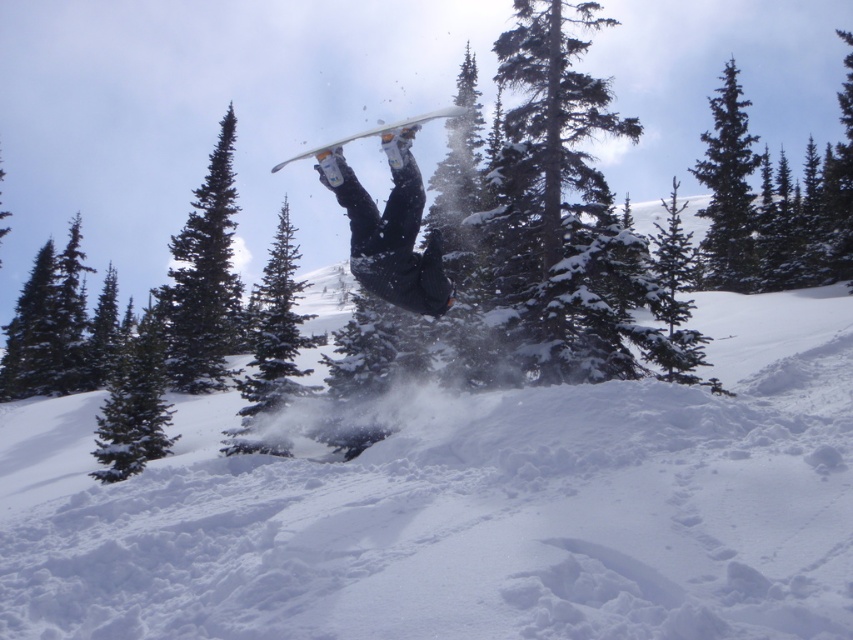
You are a photographer trying to capture the snowboarder midair. You notice the white fluffy snow at center and the matte black snowboard at center in your frame. Which object in your viewfinder appears wider?

The white fluffy snow at center appears wider than the matte black snowboard at center because its width is larger according to the description.

You are a photographer trying to capture the snowboarder midair between the two green matte trees. Which tree, the green matte tree at upper left or the green matte tree at upper right, should you position your camera closer to in order to frame the snowboarder properly?

The green matte tree at upper left is smaller than the green matte tree at upper right. To frame the snowboarder properly, position the camera closer to the green matte tree at upper left to ensure both trees are balanced in the composition.

You are a photographer aiming to capture the snowboarder midair between the green matte tree at upper left and the green matte tree at upper right. Which tree should you position yourself closer to in order to frame the snowboarder between them?

A: You should position yourself closer to the green matte tree at upper left because it is to the left of the green matte tree at upper right, allowing you to frame the snowboarder between them.